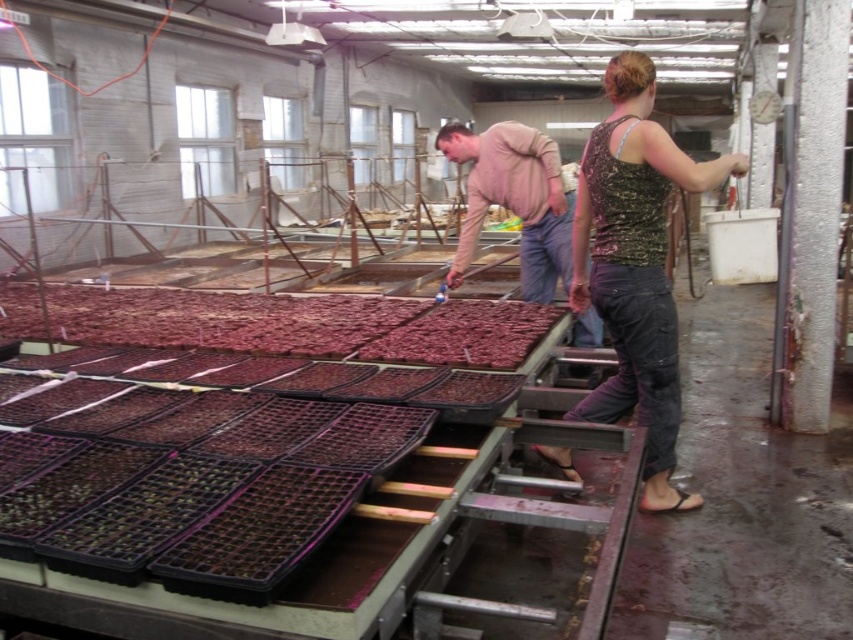
Is point (283, 518) more distant than point (595, 248)?

No, it is not.

Who is positioned more to the left, black plastic trays at lower left or camouflage tank top at center?

From the viewer's perspective, black plastic trays at lower left appears more on the left side.

Is point (16, 440) positioned before point (648, 221)?

Yes, point (16, 440) is closer to viewer.

The image size is (853, 640). Identify the location of black plastic trays at lower left. (215, 477).

Is point (636, 336) positioned behind point (525, 150)?

No, it is not.

In the scene shown: Is camouflage tank top at center further to camera compared to light brown cotton shirt at center?

No, camouflage tank top at center is in front of light brown cotton shirt at center.

Which is behind, point (601, 241) or point (492, 156)?

Positioned behind is point (492, 156).

The width and height of the screenshot is (853, 640). Identify the location of camouflage tank top at center. (636, 266).

Who is lower down, black plastic trays at lower left or light brown cotton shirt at center?

black plastic trays at lower left is below.

Can you confirm if black plastic trays at lower left is thinner than light brown cotton shirt at center?

No.

Measure the distance between black plastic trays at lower left and camera.

black plastic trays at lower left and camera are 4.88 feet apart from each other.

Locate an element on the screen. The image size is (853, 640). black plastic trays at lower left is located at coordinates pos(215,477).